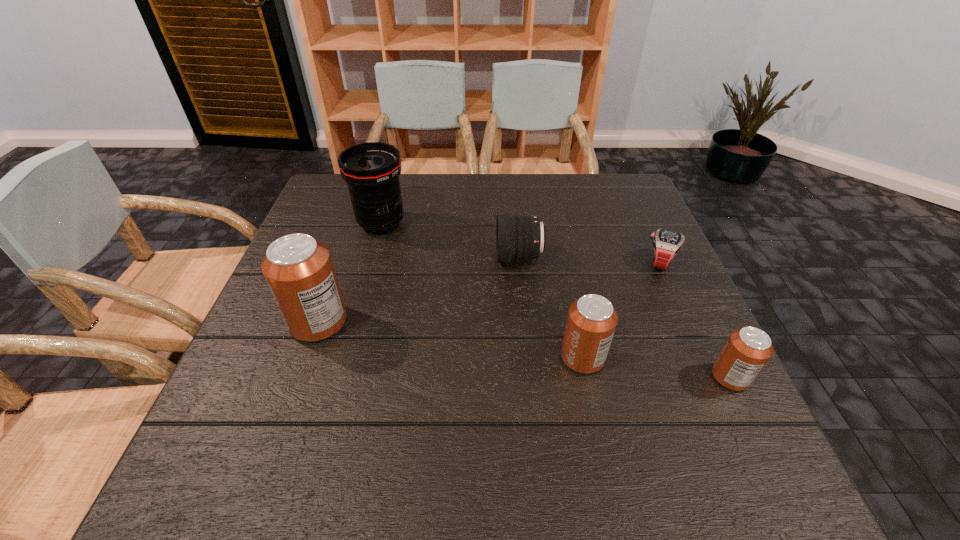
You are a GUI agent. You are given a task and a screenshot of the screen. Output one action in this format:
    pyautogui.click(x=<x>, y=<y>)
    Task: Click on the free space in the image that satisfies the following two spatial constraints: 1. on the back side of the second tallest can; 2. at the front element of the nearer telephoto lens
    This screenshot has width=960, height=540.
    Given the screenshot: What is the action you would take?
    pyautogui.click(x=562, y=257)

What are the coordinates of `blank space that satisfies the following two spatial constraints: 1. on the back side of the shortest object; 2. at the front element of the nearer telephoto lens` in the screenshot? It's located at (658, 257).